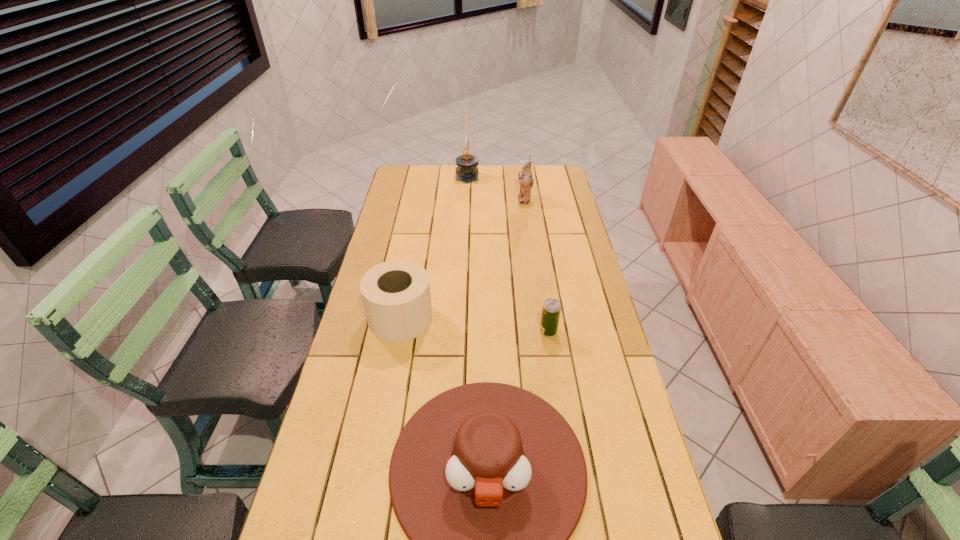
The height and width of the screenshot is (540, 960). What are the coordinates of `vacant point located 0.330m on the right of the third tallest object` in the screenshot? It's located at (536, 318).

Identify the location of free spot located 0.360m on the front of the beer can. (566, 450).

In order to click on object situated at the far edge in this screenshot , I will do `click(467, 163)`.

At what (x,y) coordinates should I click in order to perform the action: click on object present at the left edge. Please return your answer as a coordinate pair (x, y). Image resolution: width=960 pixels, height=540 pixels. Looking at the image, I should click on (396, 295).

What are the coordinates of `free space at the far edge of the desktop` in the screenshot? It's located at (428, 187).

Locate an element on the screen. vacant space at the right edge of the desktop is located at coordinates (605, 396).

In the image, there is a desktop. Identify the location of vacant space at the far left corner. (404, 166).

Identify the location of free spot between the second farthest object and the farthest object. Image resolution: width=960 pixels, height=540 pixels. (495, 187).

The image size is (960, 540). What are the coordinates of `vacant region between the oil lamp and the beer can` in the screenshot? It's located at (508, 253).

Identify the location of vacant area between the beer can and the third shortest object. (474, 325).